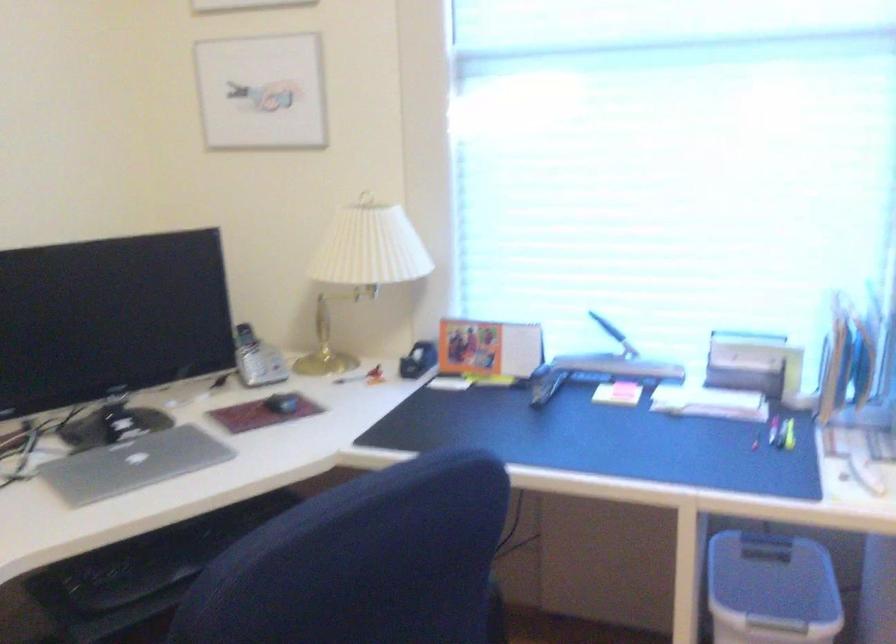
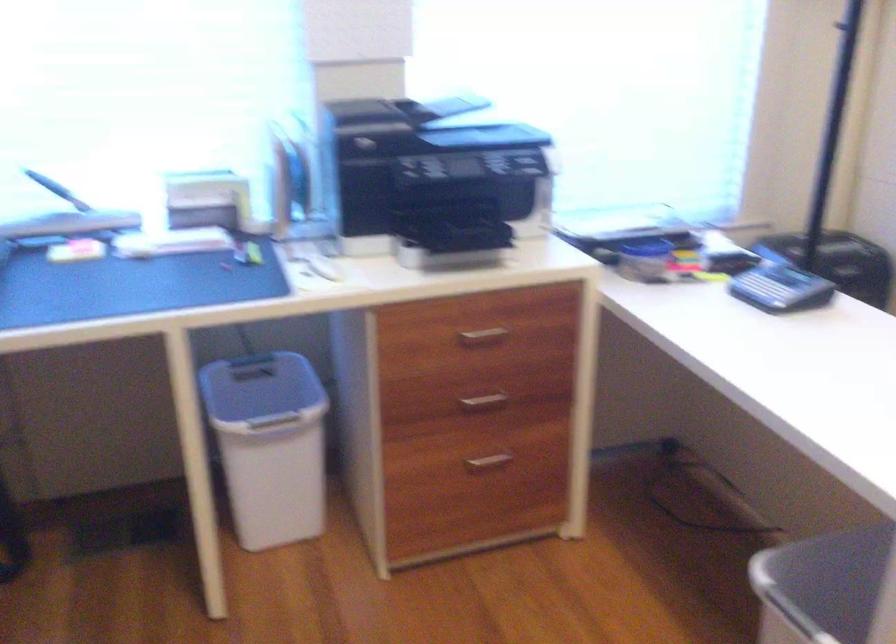
The point at (771,573) is marked in the first image. Where is the corresponding point in the second image?

(261, 390)